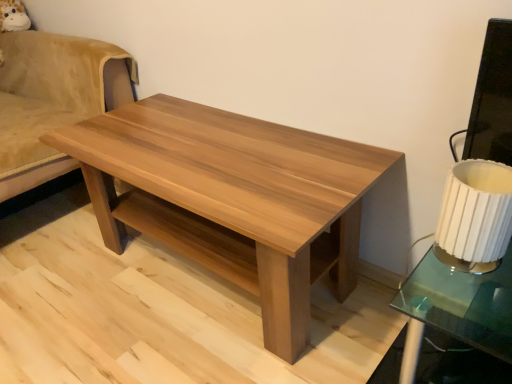
Question: Is light brown wood swivel chair at left not close to natural wood coffee table at center?

Choices:
 (A) yes
 (B) no

Answer: (B)

Question: Can you confirm if light brown wood swivel chair at left is bigger than natural wood coffee table at center?

Choices:
 (A) yes
 (B) no

Answer: (A)

Question: From the image's perspective, does light brown wood swivel chair at left appear lower than natural wood coffee table at center?

Choices:
 (A) yes
 (B) no

Answer: (B)

Question: From a real-world perspective, is light brown wood swivel chair at left located beneath natural wood coffee table at center?

Choices:
 (A) yes
 (B) no

Answer: (B)

Question: Does light brown wood swivel chair at left have a greater width compared to natural wood coffee table at center?

Choices:
 (A) no
 (B) yes

Answer: (B)

Question: In terms of size, does white pleated fabric lampshade at right appear bigger or smaller than light brown wood swivel chair at left?

Choices:
 (A) small
 (B) big

Answer: (A)

Question: Does point (503, 185) appear closer or farther from the camera than point (27, 135)?

Choices:
 (A) closer
 (B) farther

Answer: (A)

Question: Based on their positions, is white pleated fabric lampshade at right located to the left or right of light brown wood swivel chair at left?

Choices:
 (A) right
 (B) left

Answer: (A)

Question: From the image's perspective, relative to light brown wood swivel chair at left, is white pleated fabric lampshade at right above or below?

Choices:
 (A) below
 (B) above

Answer: (A)

Question: Visually, is white pleated fabric lampshade at right positioned to the left or to the right of natural wood coffee table at center?

Choices:
 (A) right
 (B) left

Answer: (A)

Question: Relative to natural wood coffee table at center, is white pleated fabric lampshade at right in front or behind?

Choices:
 (A) front
 (B) behind

Answer: (A)

Question: From a real-world perspective, is white pleated fabric lampshade at right physically located above or below natural wood coffee table at center?

Choices:
 (A) below
 (B) above

Answer: (B)

Question: Is point (x=464, y=258) closer or farther from the camera than point (x=267, y=253)?

Choices:
 (A) closer
 (B) farther

Answer: (A)

Question: Looking at their shapes, would you say light brown wood swivel chair at left is wider or thinner than white pleated fabric lampshade at right?

Choices:
 (A) thin
 (B) wide

Answer: (B)

Question: Do you think light brown wood swivel chair at left is within white pleated fabric lampshade at right, or outside of it?

Choices:
 (A) outside
 (B) inside

Answer: (A)